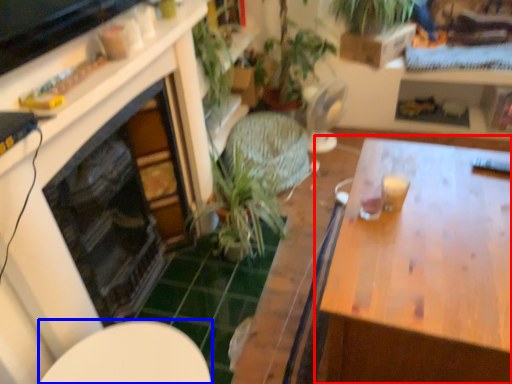
Question: Which object is closer to the camera taking this photo, table (highlighted by a red box) or round table (highlighted by a blue box)?

Choices:
 (A) table
 (B) round table

Answer: (B)